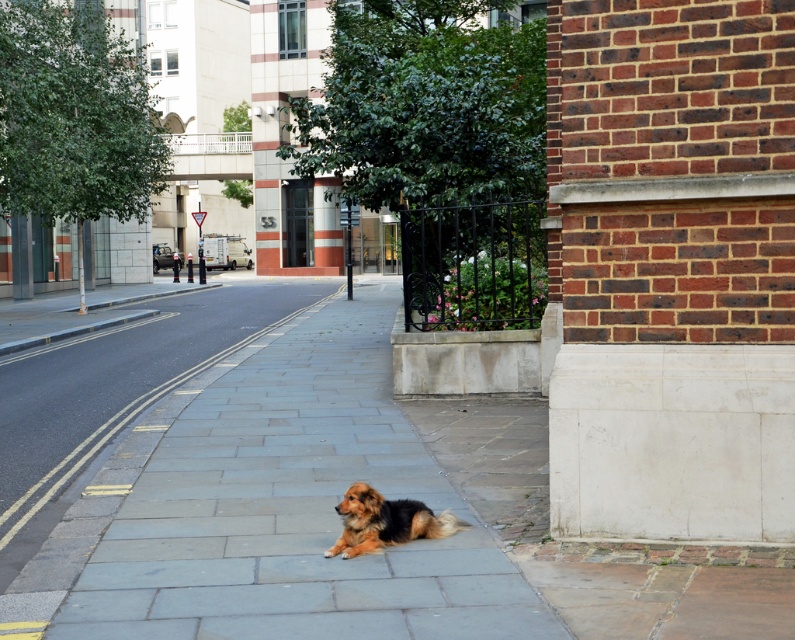
You are standing at the point with coordinates point (x=249, y=378) and want to walk to the point with coordinates point (x=351, y=536). Which direction should you move to reach your destination?

Since point (x=249, y=378) is behind point (x=351, y=536), you should move forward to reach your destination.

You are standing at the point marked by coordinates point (518, 618) in the image and want to walk to the nearest building entrance. The entrance is located 6 meters away from your current position. Can you reach the entrance without moving more than 6 meters?

The distance between point (518, 618) and the viewer is 5.27 meters. Since the entrance is 6 meters away from your current position, you can reach it without moving more than 6 meters.

You are a delivery robot that needs to pass by the brown fluffy dog at center. The robot is 0.5 meters wide. Can you safely navigate through the gray stone pavement at center without hitting the dog?

The gray stone pavement at center is wider than the brown fluffy dog at center, so yes, the robot can safely navigate through the gray stone pavement at center as it has enough width to avoid the dog.